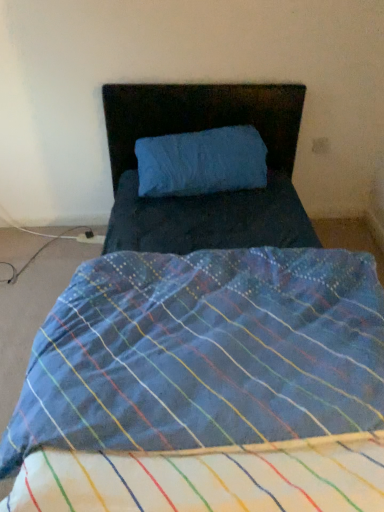
Locate an element on the screen. The image size is (384, 512). blue fabric pillow at center is located at coordinates (201, 116).

The image size is (384, 512). What do you see at coordinates (201, 116) in the screenshot?
I see `blue fabric pillow at center` at bounding box center [201, 116].

At what (x,y) coordinates should I click in order to perform the action: click on blue fabric pillow at center. Please return your answer as a coordinate pair (x, y). The image size is (384, 512). Looking at the image, I should click on (201, 116).